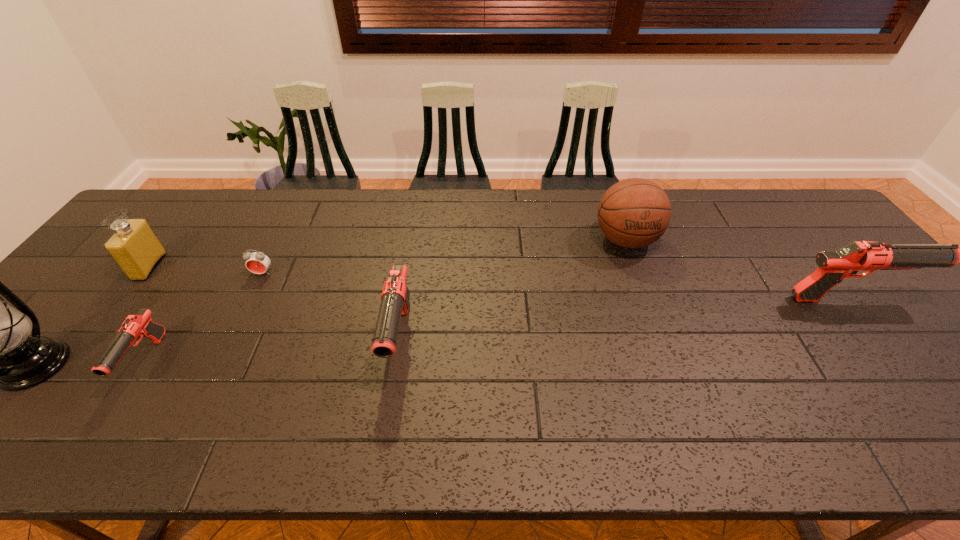
Please mark a free spot for a new gun to balance the arrangement. Please provide its 2D coordinates. Your answer should be formatted as a tuple, i.e. [(x, y)], where the tuple contains the x and y coordinates of a point satisfying the conditions above.

[(634, 318)]